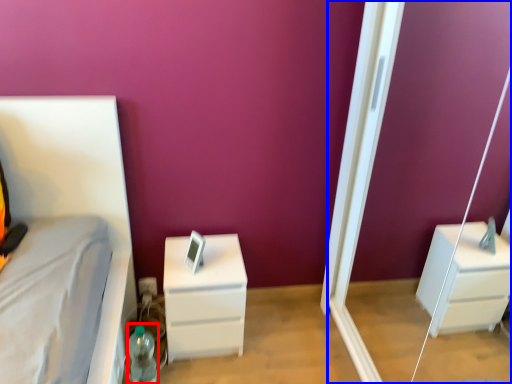
Question: Which of the following is the closest to the observer, bottle (highlighted by a red box) or screen door (highlighted by a blue box)?

Choices:
 (A) bottle
 (B) screen door

Answer: (B)